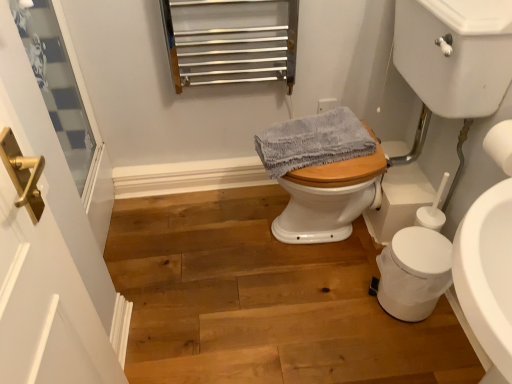
Locate an element on the screen. This screenshot has height=384, width=512. vacant space to the left of white glossy sink at center right is located at coordinates (223, 250).